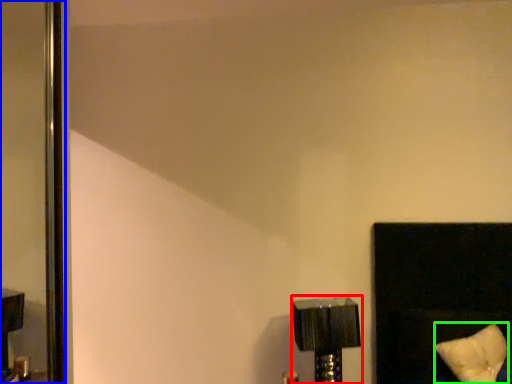
Question: Considering the real-world distances, which object is farthest from lamp (highlighted by a red box)? screen door (highlighted by a blue box) or pillow (highlighted by a green box)?

Choices:
 (A) screen door
 (B) pillow

Answer: (A)